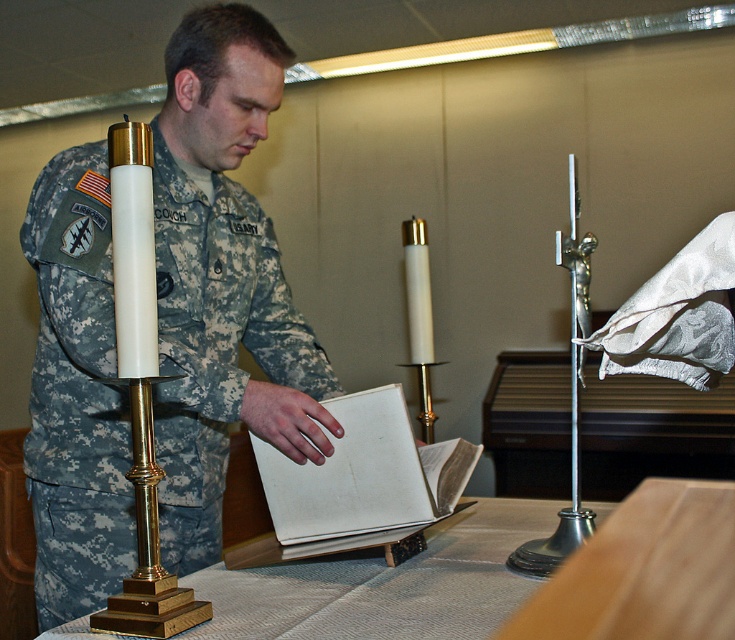
You are an interior designer planning to rearrange the items in the scene. If you want to place a new decorative item between the gold polished table at center and the white polished brass candle holder at left, where should you position it according to their current arrangement?

The gold polished table at center is located below the white polished brass candle holder at left, so you should place the new decorative item between them in the space that is above the gold polished table at center and below the white polished brass candle holder at left.

You are a tailor measuring the width of objects in the scene. You need to determine which object is wider between the camouflage fabric uniform at center and the white polished brass candle holder at left. Which one is wider?

The camouflage fabric uniform at center is wider than the white polished brass candle holder at left according to the description.